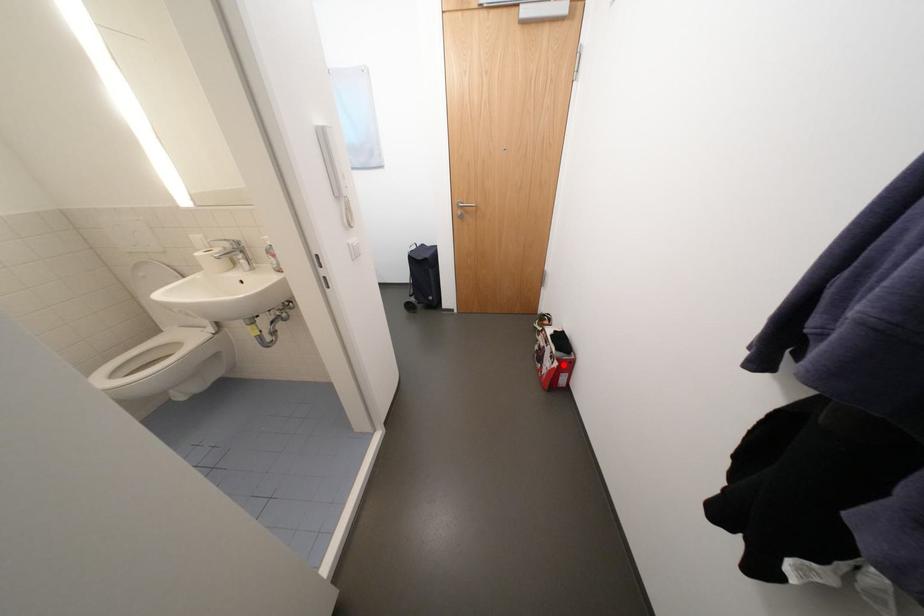
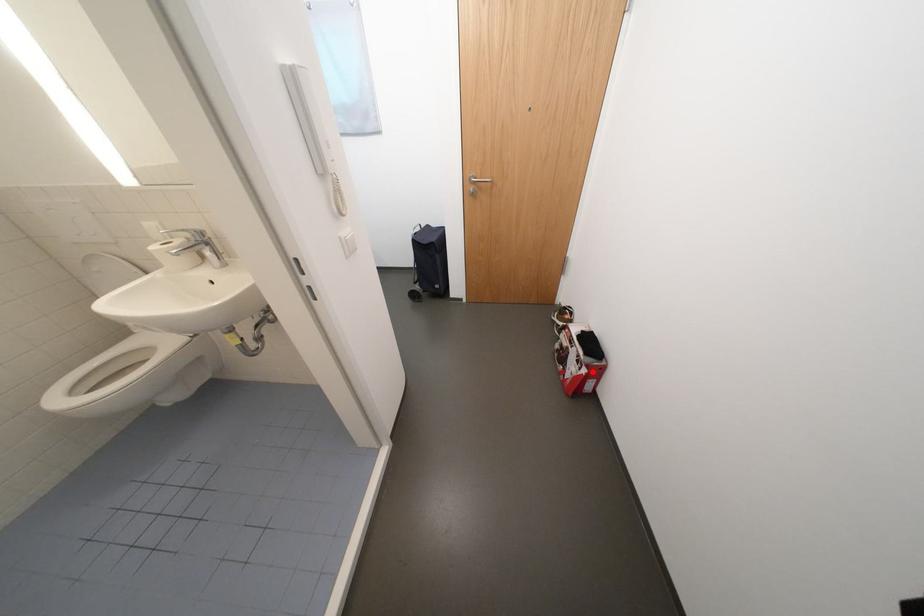
I am providing you with two images of the same scene from different viewpoints. A red point is marked on the first image and another point is marked on the second image. Is the red point in image1 aligned with the point shown in image2?

Yes